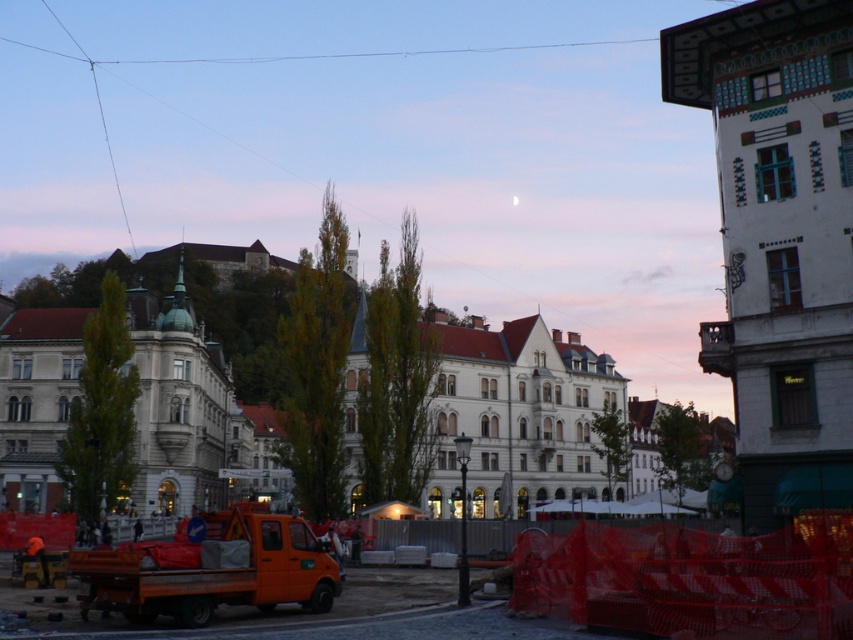
Between orange fabric at lower left and orange matte truck at lower left, which one has more height?

With more height is orange fabric at lower left.

Which is in front, point (589, 588) or point (141, 561)?

Positioned in front is point (589, 588).

Is point (666, 632) positioned in front of point (276, 586)?

Yes, point (666, 632) is closer to viewer.

The height and width of the screenshot is (640, 853). I want to click on orange fabric at lower left, so click(689, 579).

Does orange mesh barricade at lower right have a larger size compared to orange matte truck at lower left?

Yes.

Between point (735, 634) and point (103, 554), which one is positioned in front?

Point (735, 634) is in front.

Does point (712, 547) come closer to viewer compared to point (274, 556)?

Yes, it is.

The width and height of the screenshot is (853, 640). Find the location of `orange mesh barricade at lower right`. orange mesh barricade at lower right is located at coordinates (691, 579).

Can you confirm if white stone building at center is smaller than orange mesh barricade at lower right?

Incorrect, white stone building at center is not smaller in size than orange mesh barricade at lower right.

Who is more distant from viewer, [563,397] or [734,557]?

Point [563,397]

This screenshot has height=640, width=853. In order to click on white stone building at center in this screenshot , I will do `click(517, 413)`.